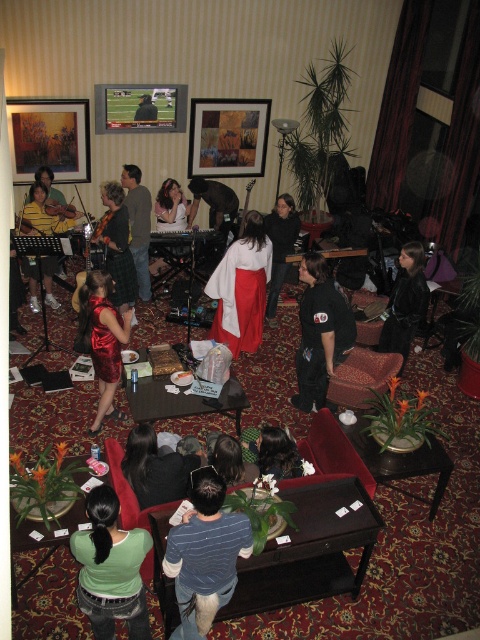
Find the location of a particular element. The image size is (480, 640). matte black kimono at center is located at coordinates (279, 244).

Is matte black kimono at center to the right of matte black guitar at center from the viewer's perspective?

Correct, you'll find matte black kimono at center to the right of matte black guitar at center.

Does point (296, 232) come closer to viewer compared to point (200, 189)?

Yes, point (296, 232) is in front of point (200, 189).

What are the coordinates of `matte black kimono at center` in the screenshot? It's located at (279, 244).

Which of these two, wooden drum at center or smooth black shirt at center, stands taller?

smooth black shirt at center is taller.

Which of these two, wooden drum at center or smooth black shirt at center, stands shorter?

Standing shorter between the two is wooden drum at center.

This screenshot has width=480, height=640. Identify the location of wooden drum at center. (343, 252).

Is black leather jacket at center above dark brown hair at center?

Yes.

Looking at this image, can you confirm if black leather jacket at center is shorter than dark brown hair at center?

No, black leather jacket at center is not shorter than dark brown hair at center.

Identify the location of black leather jacket at center. The image size is (480, 640). (405, 301).

Find the location of a particular element. This screenshot has height=640, width=480. black leather jacket at center is located at coordinates (405, 301).